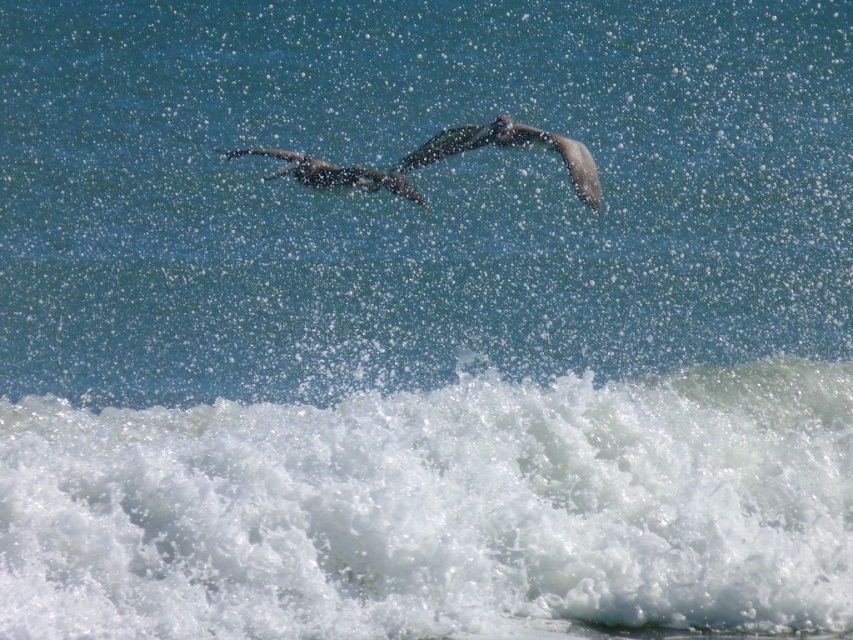
Does light brown feathered bird at upper center have a lesser width compared to smooth gray bird at center?

Incorrect, light brown feathered bird at upper center's width is not less than smooth gray bird at center's.

Which of these two, light brown feathered bird at upper center or smooth gray bird at center, stands shorter?

smooth gray bird at center

This screenshot has width=853, height=640. What do you see at coordinates (511, 147) in the screenshot?
I see `light brown feathered bird at upper center` at bounding box center [511, 147].

At what (x,y) coordinates should I click in order to perform the action: click on light brown feathered bird at upper center. Please return your answer as a coordinate pair (x, y). Looking at the image, I should click on (511, 147).

Between point (636, 465) and point (465, 148), which one is positioned in front?

Point (636, 465) is more forward.

Image resolution: width=853 pixels, height=640 pixels. What do you see at coordinates (438, 509) in the screenshot?
I see `white frothy wave at lower center` at bounding box center [438, 509].

This screenshot has width=853, height=640. What are the coordinates of `white frothy wave at lower center` in the screenshot? It's located at (438, 509).

Is point (132, 554) positioned after point (361, 179)?

No, it is not.

Is white frothy wave at lower center to the right of smooth gray bird at center from the viewer's perspective?

No, white frothy wave at lower center is not to the right of smooth gray bird at center.

The image size is (853, 640). Find the location of `white frothy wave at lower center`. white frothy wave at lower center is located at coordinates (438, 509).

The image size is (853, 640). Find the location of `white frothy wave at lower center`. white frothy wave at lower center is located at coordinates (438, 509).